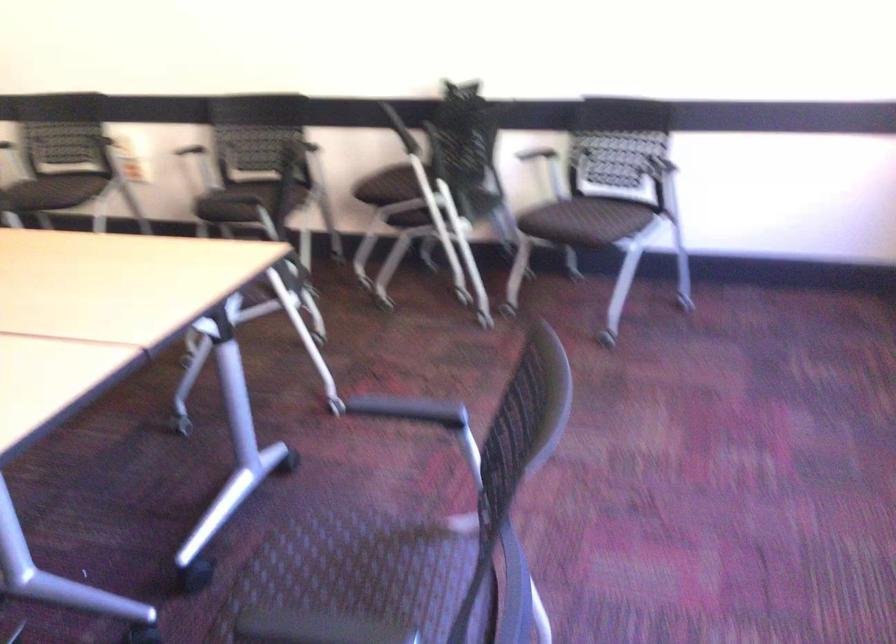
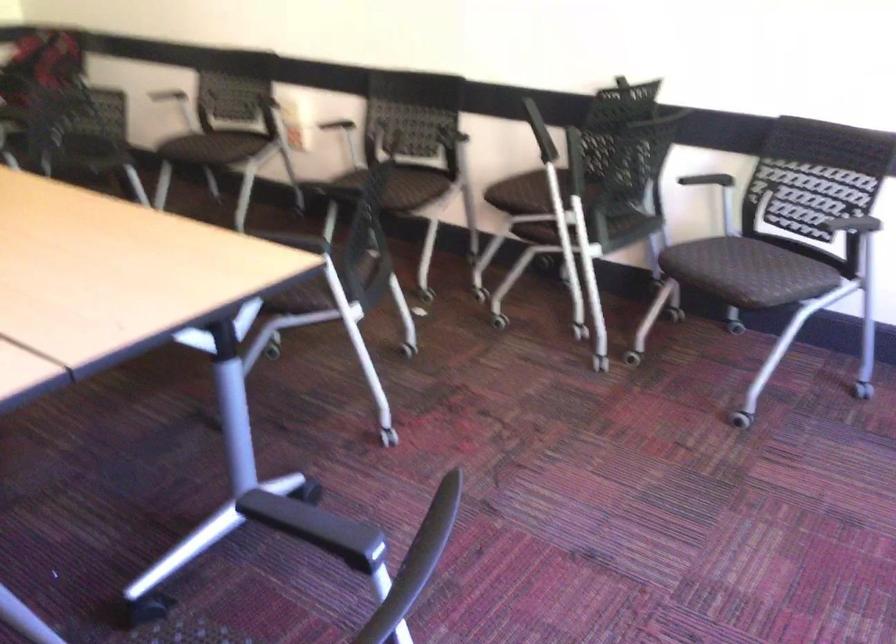
Where in the second image is the point corresponding to (392,185) from the first image?

(526, 193)